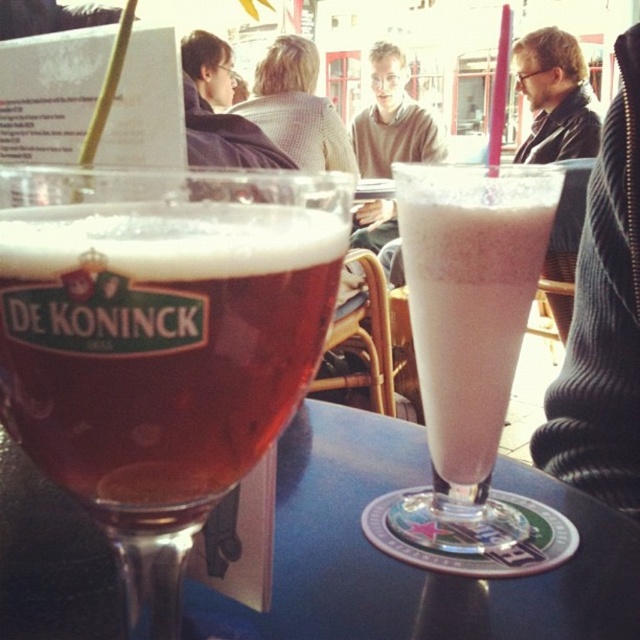
Who is higher up, translucent glass beer at center or milky white frosted glass at center?

milky white frosted glass at center

Which is more to the right, translucent glass beer at center or milky white frosted glass at center?

milky white frosted glass at center

This screenshot has width=640, height=640. I want to click on translucent glass beer at center, so click(x=161, y=342).

Can you confirm if milky white frosted glass at center is positioned to the left of light beige sweater at center?

In fact, milky white frosted glass at center is to the right of light beige sweater at center.

Which is in front, point (486, 272) or point (314, 141)?

Point (486, 272) is more forward.

Locate an element on the screen. The height and width of the screenshot is (640, 640). milky white frosted glass at center is located at coordinates (468, 333).

Looking at this image, is the position of translucent glass beer at center more distant than that of light beige sweater at center?

No, it is in front of light beige sweater at center.

Does point (298, 381) come in front of point (339, 152)?

Yes, it is in front of point (339, 152).

I want to click on translucent glass beer at center, so click(x=161, y=342).